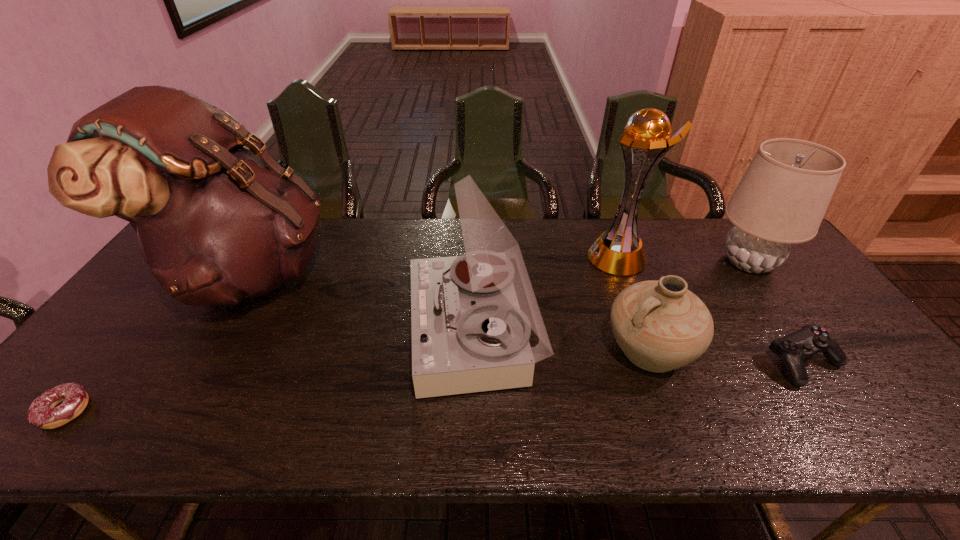
Find the location of a particular element. vacant space that satisfies the following two spatial constraints: 1. on the back side of the lampshade; 2. on the right side of the pottery is located at coordinates (617, 262).

The height and width of the screenshot is (540, 960). What are the coordinates of `free space in the image that satisfies the following two spatial constraints: 1. on the back side of the record player; 2. on the left side of the lampshade` in the screenshot? It's located at (x=474, y=262).

Locate an element on the screen. The height and width of the screenshot is (540, 960). vacant space that satisfies the following two spatial constraints: 1. on the back side of the second shortest object; 2. on the front-facing side of the trophy is located at coordinates (732, 257).